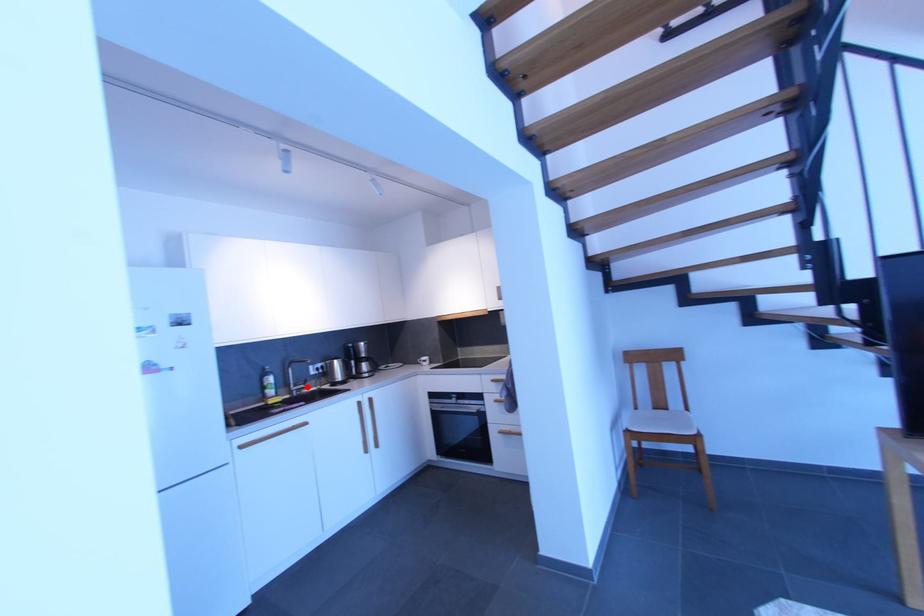
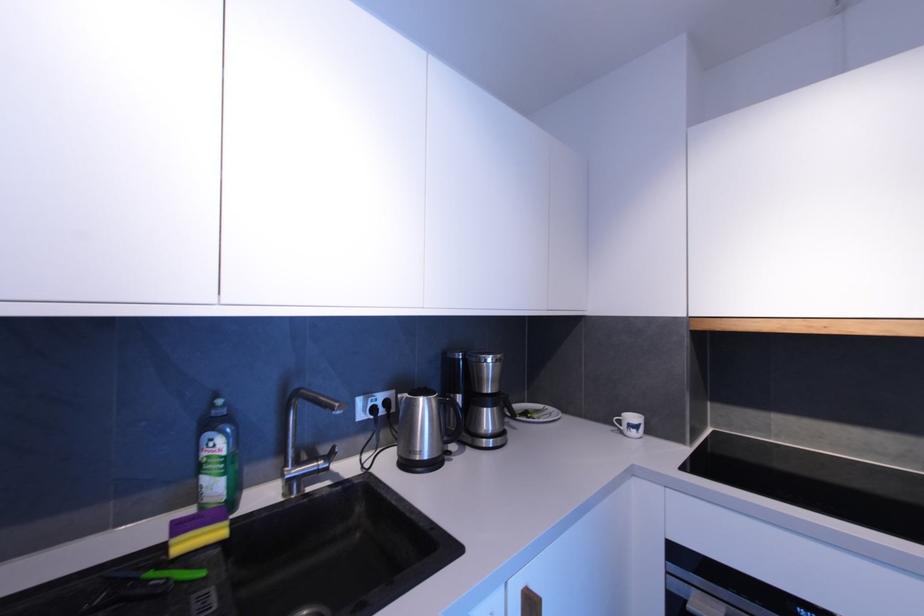
Locate, in the second image, the point that corresponds to the highlighted location in the first image.

(325, 464)